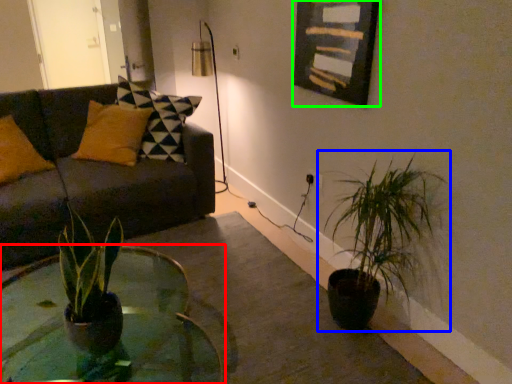
Question: Which is nearer to the coffee table (highlighted by a red box)? houseplant (highlighted by a blue box) or picture frame (highlighted by a green box).

Choices:
 (A) houseplant
 (B) picture frame

Answer: (A)